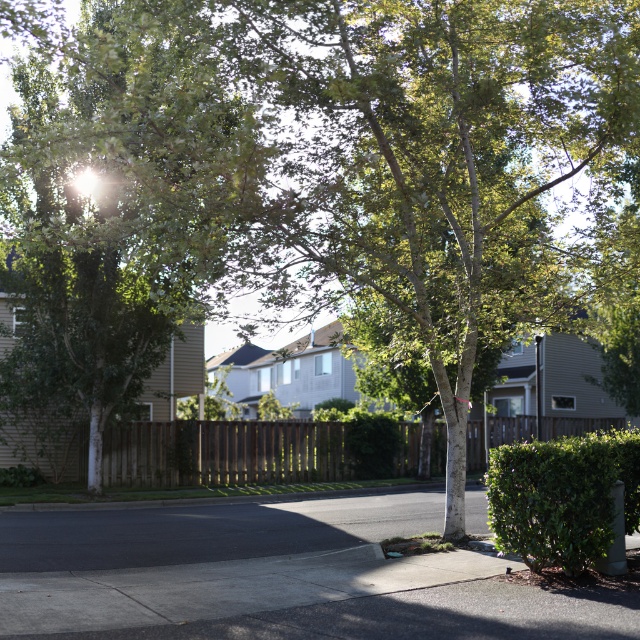
In the scene shown: You are a gardener standing on the sidewalk and want to trim both the green leafy hedge at lower right and the brown wood fence at center. Which object is farther away from you?

The green leafy hedge at lower right is behind the brown wood fence at center, so it is farther away from you.

You are a gardener standing on the sidewalk and want to trim the green leafy hedge at lower right. Which side of the brown wood fence at center should you approach from to access the hedge?

The brown wood fence at center is positioned on the right side of the green leafy hedge at lower right, so you should approach from the left side of the brown wood fence at center to access the hedge.